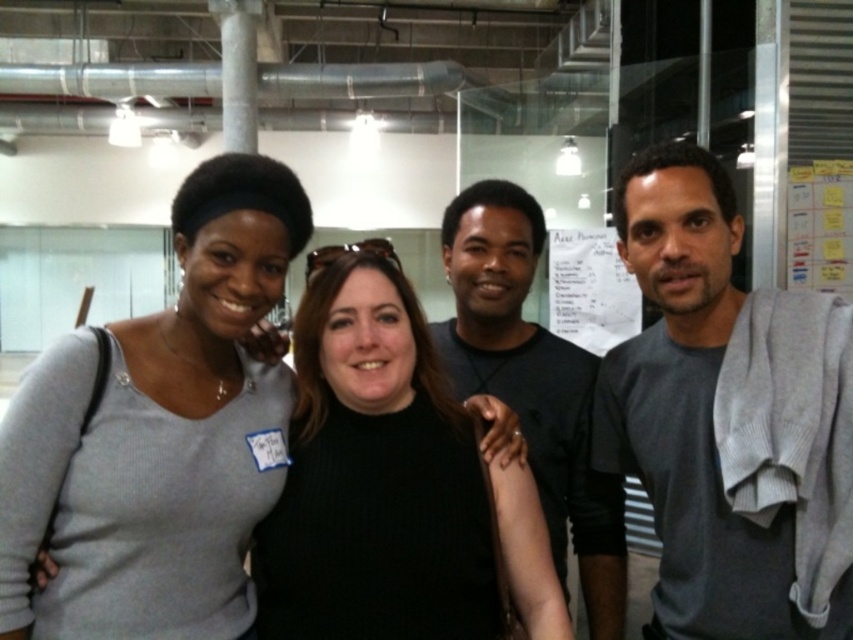
You are navigating through an office space and need to reach a specific location marked by point (509,237). There is an obstacle at point (15,534). Can you safely move around the obstacle to your destination?

Point (15,534) is in front of point (509,237), so the obstacle is blocking the path. You need to go around it to reach your destination.

In the scene shown: You are organizing a photo shoot and need to arrange two models wearing the gray cotton shirt at right and dark gray shirt at center so that the shorter model stands behind the taller one. Based on the scene description, which model should be placed where?

The gray cotton shirt at right has a lesser height compared to dark gray shirt at center. Therefore, the model wearing the gray cotton shirt at right should be placed behind the model wearing the dark gray shirt at center.

You are standing in the office and want to hand a document to the person closest to you. You see the gray cotton shirt at right and the matte gray sweater at center. Which one should you approach?

You should approach the gray cotton shirt at right because it is closer to you than the matte gray sweater at center.